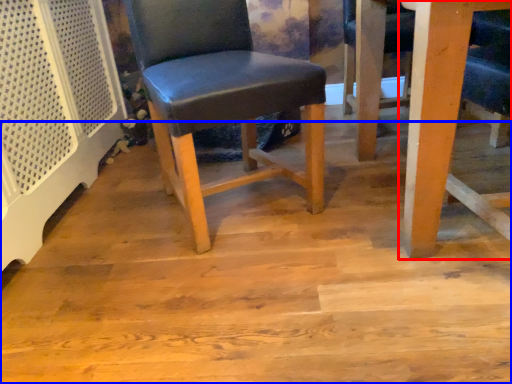
Question: Which of the following is the closest to the observer, table (highlighted by a red box) or plywood (highlighted by a blue box)?

Choices:
 (A) table
 (B) plywood

Answer: (A)